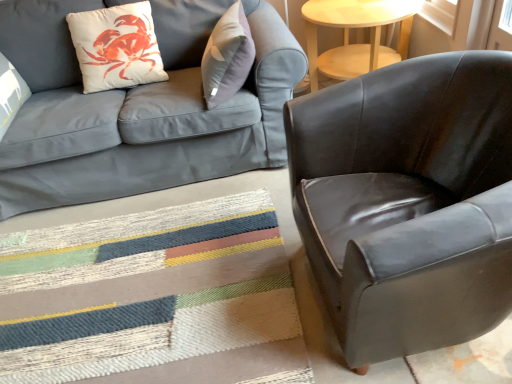
Locate an element on the screen. empty space that is ontop of textured woven mat at lower center (from a real-world perspective) is located at coordinates (133, 282).